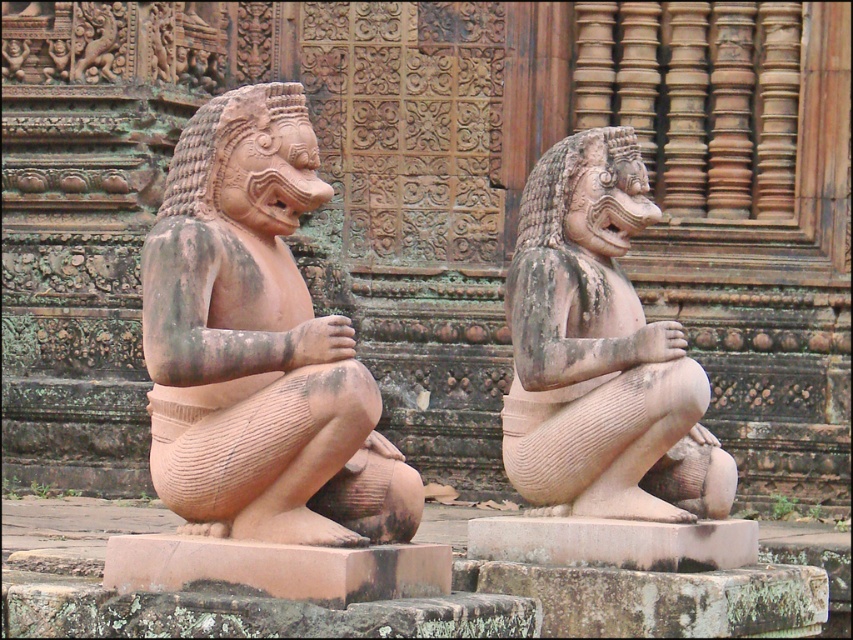
Who is positioned more to the right, earthy stone statue at left or matte stone statue at center?

Positioned to the right is matte stone statue at center.

From the picture: Can you confirm if earthy stone statue at left is wider than matte stone statue at center?

Incorrect, earthy stone statue at left's width does not surpass matte stone statue at center's.

Describe the element at coordinates (258, 346) in the screenshot. I see `earthy stone statue at left` at that location.

Locate an element on the screen. The image size is (853, 640). earthy stone statue at left is located at coordinates (258, 346).